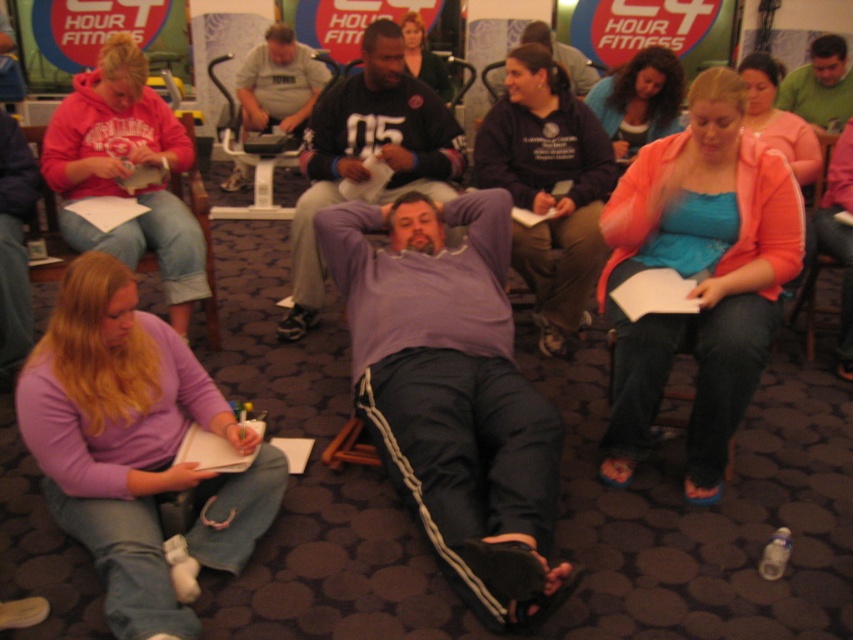
Question: Can you confirm if purple cotton shirt at center is wider than purple matte shirt at center?

Choices:
 (A) no
 (B) yes

Answer: (A)

Question: Which point appears farthest from the camera in this image?

Choices:
 (A) (556, 301)
 (B) (758, 291)
 (C) (772, 112)
 (D) (844, 49)

Answer: (D)

Question: Does green cotton shirt at upper right appear over matte purple shirt at center?

Choices:
 (A) no
 (B) yes

Answer: (A)

Question: Is purple matte shirt at center positioned at the back of matte gray shirt at center?

Choices:
 (A) yes
 (B) no

Answer: (B)

Question: Which point is closer to the camera?

Choices:
 (A) purple soft fabric shirt at lower left
 (B) matte green sweater at upper center
 (C) matte purple shirt at center

Answer: (A)

Question: Which of the following is the closest to the observer?

Choices:
 (A) (161, 413)
 (B) (753, 60)
 (C) (422, 45)
 (D) (625, 461)

Answer: (A)